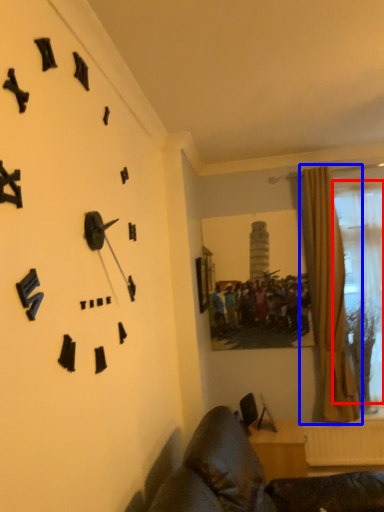
Question: Which object is further to the camera taking this photo, bay window (highlighted by a red box) or curtain (highlighted by a blue box)?

Choices:
 (A) bay window
 (B) curtain

Answer: (A)